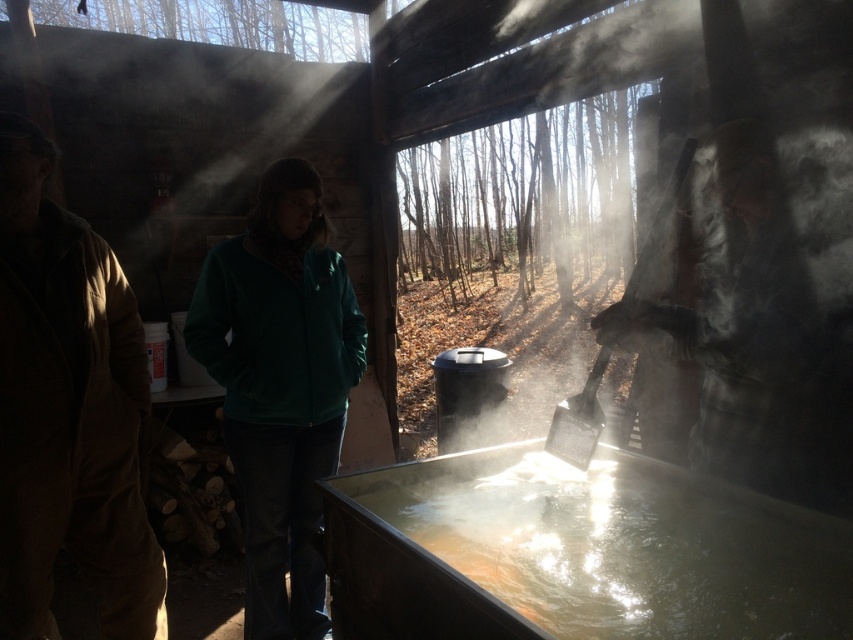
Question: Which of these objects is positioned farthest from the brown corduroy jacket at left?

Choices:
 (A) green matte jacket at center
 (B) translucent metallic water at center

Answer: (B)

Question: Which object is positioned farthest from the brown corduroy jacket at left?

Choices:
 (A) translucent metallic water at center
 (B) green matte jacket at center

Answer: (A)

Question: Is translucent metallic water at center closer to the viewer compared to brown corduroy jacket at left?

Choices:
 (A) no
 (B) yes

Answer: (B)

Question: Can you confirm if brown corduroy jacket at left is positioned above green matte jacket at center?

Choices:
 (A) yes
 (B) no

Answer: (A)

Question: Does translucent metallic water at center appear over green matte jacket at center?

Choices:
 (A) no
 (B) yes

Answer: (A)

Question: Which object appears farthest from the camera in this image?

Choices:
 (A) translucent metallic water at center
 (B) brown corduroy jacket at left

Answer: (B)